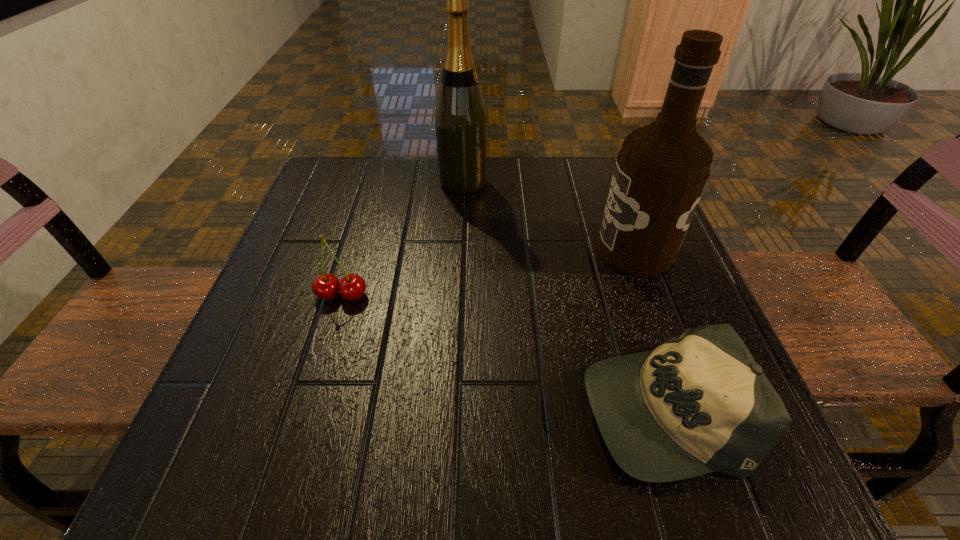
The width and height of the screenshot is (960, 540). I want to click on vacant area located on the label of the third nearest object, so click(510, 249).

Locate an element on the screen. Image resolution: width=960 pixels, height=540 pixels. vacant point located 0.280m with the stems of the cherry pointing upwards is located at coordinates (288, 474).

You are a GUI agent. You are given a task and a screenshot of the screen. Output one action in this format:
    pyautogui.click(x=<x>, y=<y>)
    Task: Click on the free space located on the front-facing side of the baseball cap
    This screenshot has width=960, height=540.
    Given the screenshot: What is the action you would take?
    [x=489, y=407]

I want to click on blank space located on the front-facing side of the baseball cap, so click(339, 407).

Find the location of a particular element. free region located on the front-facing side of the baseball cap is located at coordinates (496, 407).

I want to click on object that is at the far edge, so click(460, 118).

This screenshot has width=960, height=540. In order to click on object that is at the near edge in this screenshot , I will do `click(699, 403)`.

Locate an element on the screen. The width and height of the screenshot is (960, 540). object at the left edge is located at coordinates (326, 286).

Locate an element on the screen. The height and width of the screenshot is (540, 960). alcohol located at the right edge is located at coordinates (661, 170).

The image size is (960, 540). I want to click on baseball cap situated at the right edge, so click(699, 403).